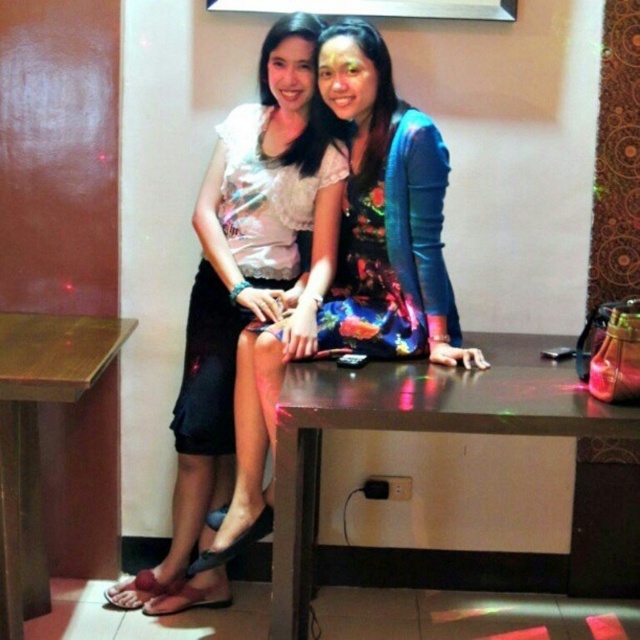
Question: Does floral fabric dress at center appear on the left side of wooden table at lower left?

Choices:
 (A) no
 (B) yes

Answer: (A)

Question: Is matte floral dress at center to the right of wooden table at lower left from the viewer's perspective?

Choices:
 (A) no
 (B) yes

Answer: (B)

Question: Can you confirm if white lace blouse at upper center is positioned to the right of wooden table at lower left?

Choices:
 (A) yes
 (B) no

Answer: (A)

Question: Which point is closer to the camera taking this photo?

Choices:
 (A) (388, 156)
 (B) (24, 449)
 (C) (179, 465)
 (D) (632, 416)

Answer: (D)

Question: Which object is farther from the camera taking this photo?

Choices:
 (A) wooden table at lower left
 (B) floral satin dress at center
 (C) floral fabric dress at center

Answer: (B)

Question: Which object is farther from the camera taking this photo?

Choices:
 (A) floral satin dress at center
 (B) floral fabric dress at center
 (C) metallic brown table at center
 (D) white lace blouse at upper center

Answer: (A)